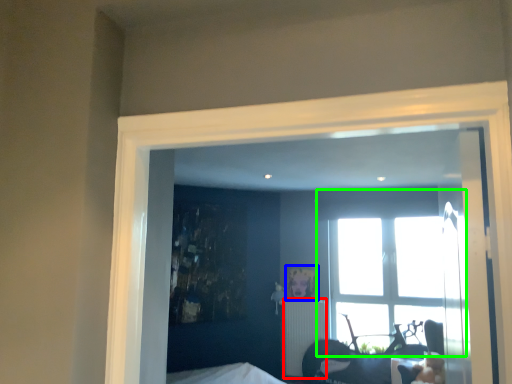
Question: Which object is the farthest from radiator (highlighted by a red box)? Choose among these: picture frame (highlighted by a blue box) or window (highlighted by a green box).

Choices:
 (A) picture frame
 (B) window

Answer: (B)